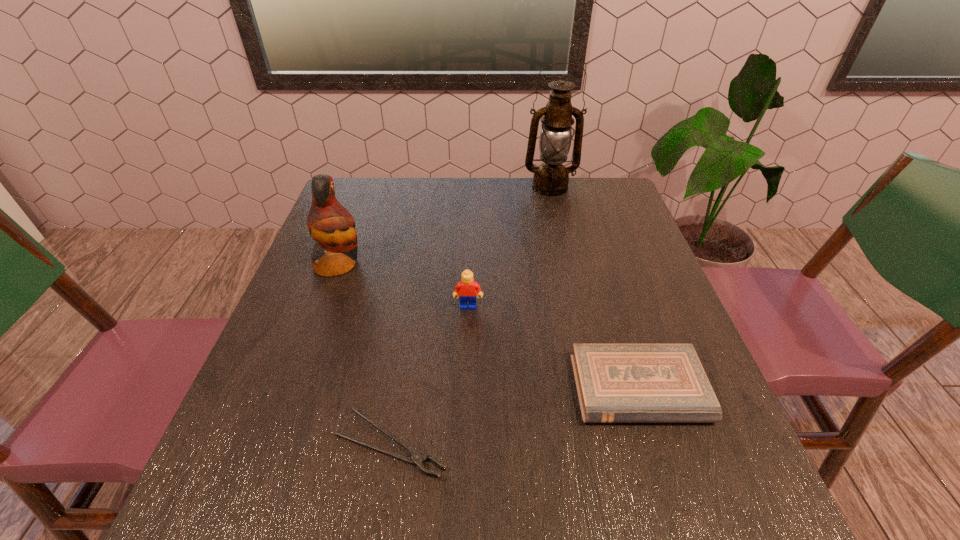
Where is `vacant area situated on the face of the Lego`? The width and height of the screenshot is (960, 540). vacant area situated on the face of the Lego is located at coordinates (468, 346).

The image size is (960, 540). I want to click on vacant area situated on the spine side of the fourth tallest object, so click(x=663, y=466).

In order to click on vacant space positioned 0.190m on the right of the shortest object in this screenshot , I will do `click(560, 444)`.

You are a GUI agent. You are given a task and a screenshot of the screen. Output one action in this format:
    pyautogui.click(x=<x>, y=<y>)
    Task: Click on the object that is at the far edge
    The image size is (960, 540).
    Given the screenshot: What is the action you would take?
    pyautogui.click(x=551, y=178)

I want to click on object that is at the near edge, so click(416, 458).

The width and height of the screenshot is (960, 540). In order to click on object located at the left edge in this screenshot , I will do `click(330, 224)`.

The width and height of the screenshot is (960, 540). Identify the location of oil lamp that is at the right edge. (551, 178).

Locate an element on the screen. The width and height of the screenshot is (960, 540). Bible that is at the right edge is located at coordinates [616, 383].

Image resolution: width=960 pixels, height=540 pixels. Identify the location of object that is at the far right corner. (551, 178).

The width and height of the screenshot is (960, 540). Find the location of `free space at the far edge of the desktop`. free space at the far edge of the desktop is located at coordinates (467, 189).